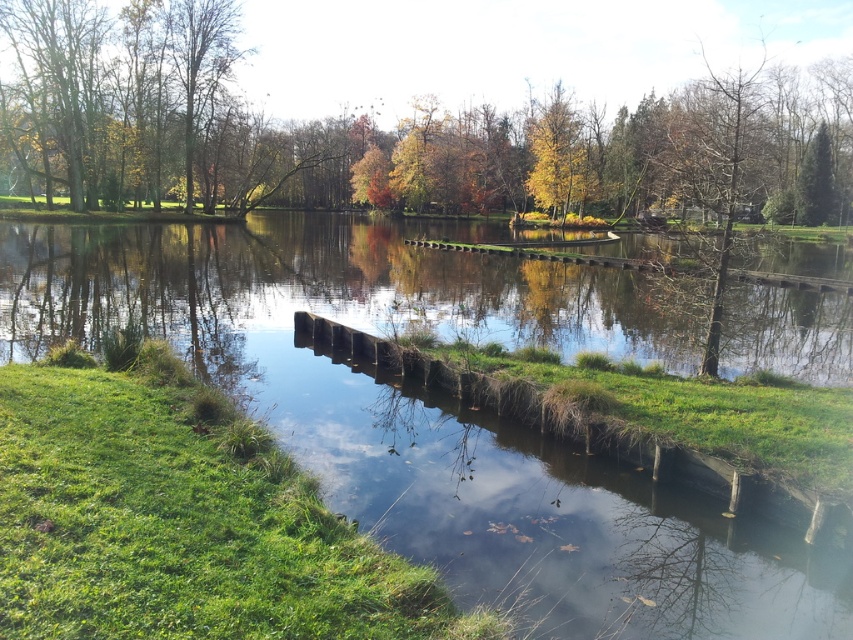
Does green grassy river at center appear on the left side of bare branches at upper right?

Correct, you'll find green grassy river at center to the left of bare branches at upper right.

Between green grassy river at center and bare branches at upper right, which one has more height?

bare branches at upper right is taller.

Image resolution: width=853 pixels, height=640 pixels. In order to click on green grassy river at center in this screenshot , I will do `click(450, 416)`.

Does green grassy river at center lie in front of yellow-green leaves at upper center?

Yes, it is in front of yellow-green leaves at upper center.

Can you confirm if green grassy river at center is positioned below yellow-green leaves at upper center?

Correct, green grassy river at center is located below yellow-green leaves at upper center.

The image size is (853, 640). What do you see at coordinates (450, 416) in the screenshot?
I see `green grassy river at center` at bounding box center [450, 416].

The image size is (853, 640). Identify the location of green grassy river at center. (450, 416).

Which is behind, point (738, 150) or point (561, 106)?

Point (561, 106)

Is bare branches at upper right to the right of yellow-green leaves at upper center from the viewer's perspective?

Indeed, bare branches at upper right is positioned on the right side of yellow-green leaves at upper center.

Is point (724, 266) in front of point (575, 132)?

Yes, it is in front of point (575, 132).

At what (x,y) coordinates should I click in order to perform the action: click on bare branches at upper right. Please return your answer as a coordinate pair (x, y). The width and height of the screenshot is (853, 640). Looking at the image, I should click on (x=714, y=161).